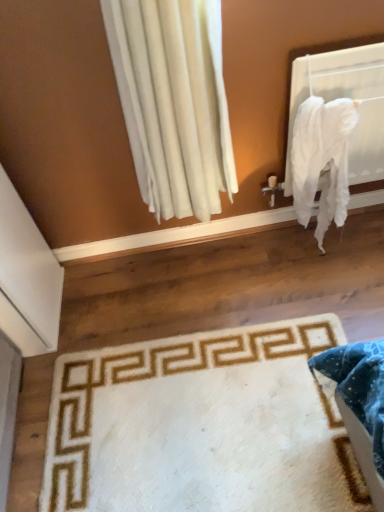
Question: Can you confirm if white fabric at upper right is taller than white cotton blanket at right?

Choices:
 (A) no
 (B) yes

Answer: (A)

Question: Does white fabric at upper right appear on the right side of white cotton blanket at right?

Choices:
 (A) yes
 (B) no

Answer: (A)

Question: From the image's perspective, is white fabric at upper right located beneath white cotton blanket at right?

Choices:
 (A) yes
 (B) no

Answer: (B)

Question: Is white fabric at upper right further to the viewer compared to white cotton blanket at right?

Choices:
 (A) yes
 (B) no

Answer: (A)

Question: Is white cotton blanket at right located within white fabric at upper right?

Choices:
 (A) no
 (B) yes

Answer: (A)

Question: Considering the relative positions of white fabric at upper right and white cotton blanket at right in the image provided, is white fabric at upper right in front of white cotton blanket at right?

Choices:
 (A) yes
 (B) no

Answer: (B)

Question: From the image's perspective, does white plush rug at lower center appear lower than white cotton blanket at right?

Choices:
 (A) no
 (B) yes

Answer: (B)

Question: Is white plush rug at lower center wider than white cotton blanket at right?

Choices:
 (A) yes
 (B) no

Answer: (A)

Question: Can you confirm if white plush rug at lower center is positioned to the right of white cotton blanket at right?

Choices:
 (A) no
 (B) yes

Answer: (A)

Question: Can you confirm if white plush rug at lower center is smaller than white cotton blanket at right?

Choices:
 (A) yes
 (B) no

Answer: (A)

Question: From a real-world perspective, is white plush rug at lower center physically above white cotton blanket at right?

Choices:
 (A) no
 (B) yes

Answer: (A)

Question: Is white plush rug at lower center oriented away from white cotton blanket at right?

Choices:
 (A) no
 (B) yes

Answer: (A)

Question: Considering the relative sizes of white fabric at upper right and white plush rug at lower center in the image provided, is white fabric at upper right wider than white plush rug at lower center?

Choices:
 (A) no
 (B) yes

Answer: (A)